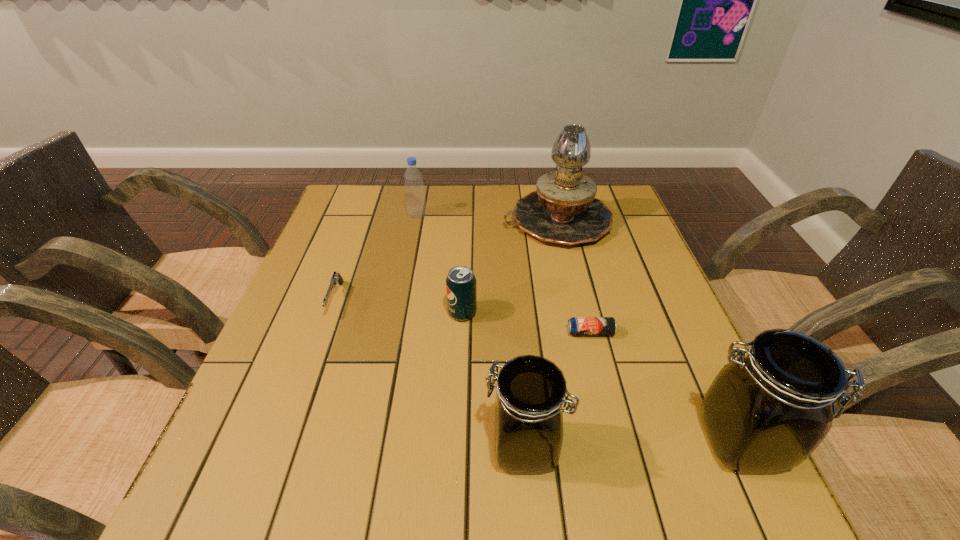
Locate an element on the screen. vacant place for an extra jar on the left is located at coordinates (301, 453).